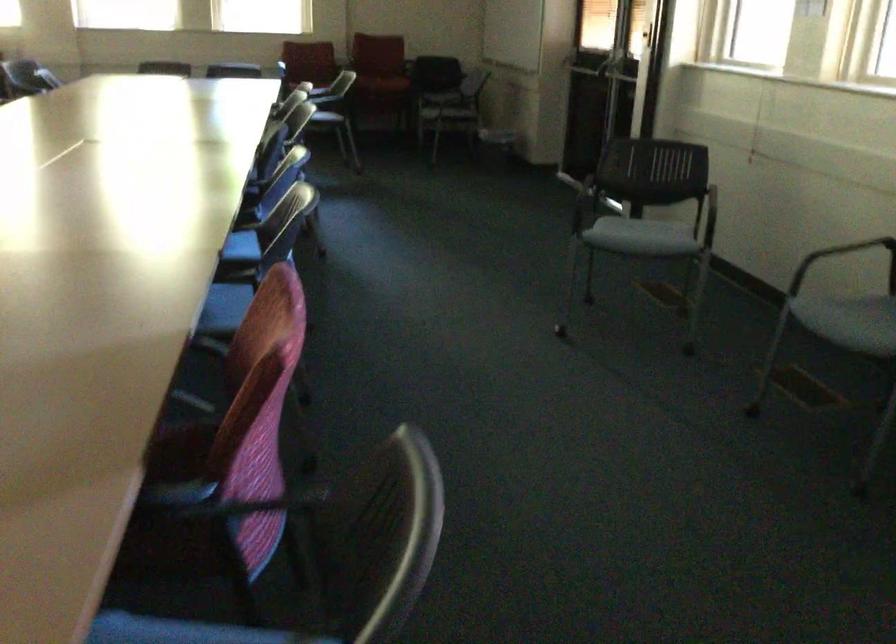
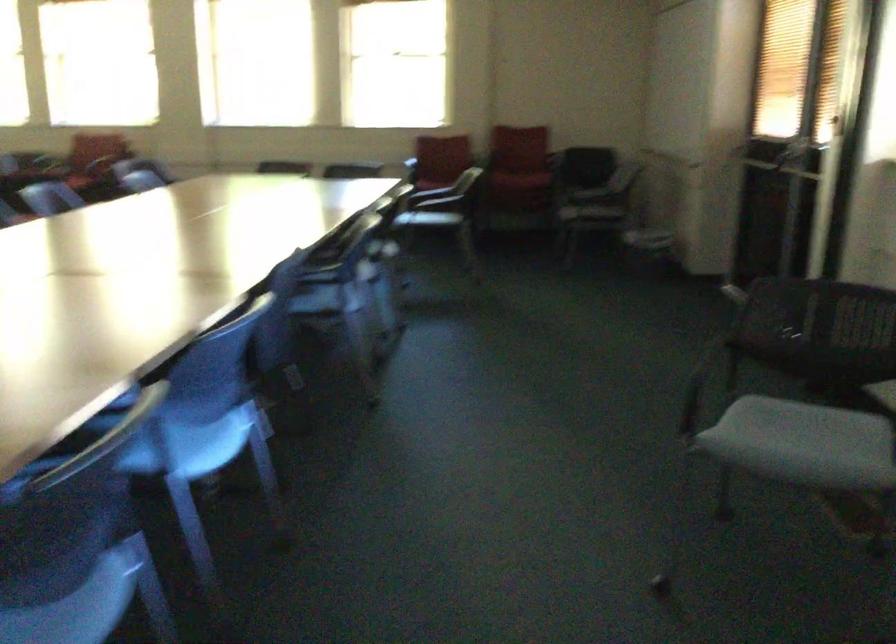
Looking at this image, in a continuous first-person perspective shot, in which direction is the camera moving?

The movement direction of the cameraman is right, forward.